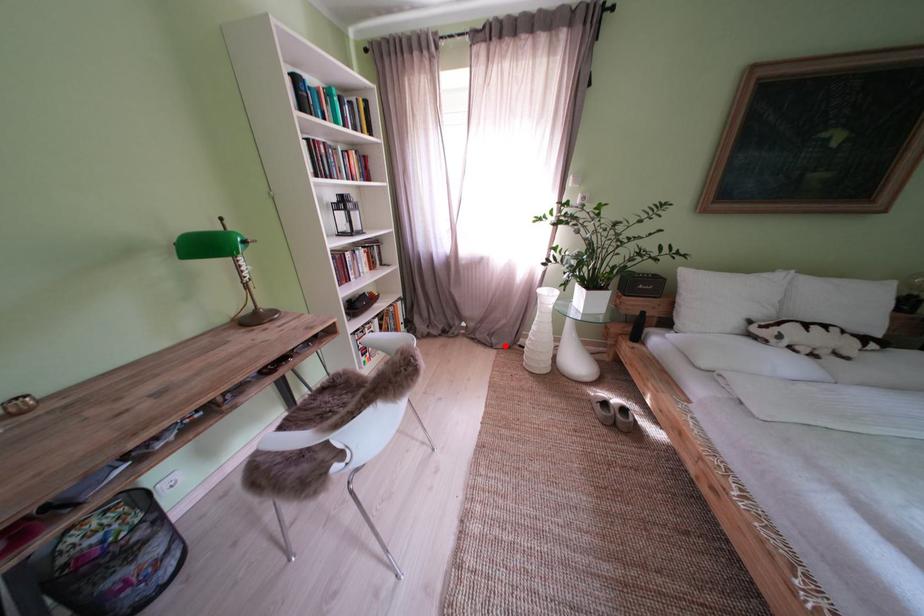
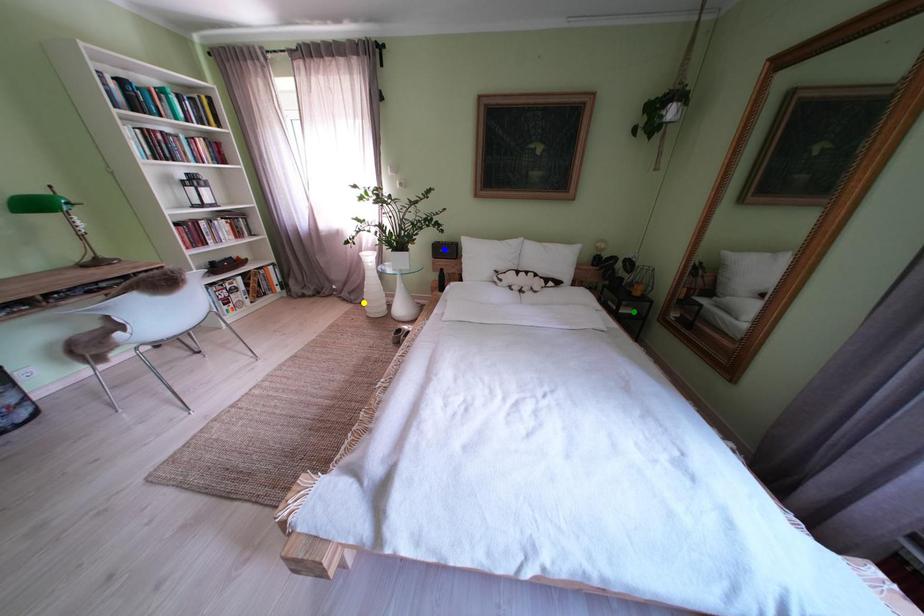
Question: I am providing you with two images of the same scene from different viewpoints. A red point is marked on the first image. You are given multiple points on the second image. Which point in image 2 is actually the same real-world point as the red point in image 1?

Choices:
 (A) green point
 (B) blue point
 (C) yellow point

Answer: (C)